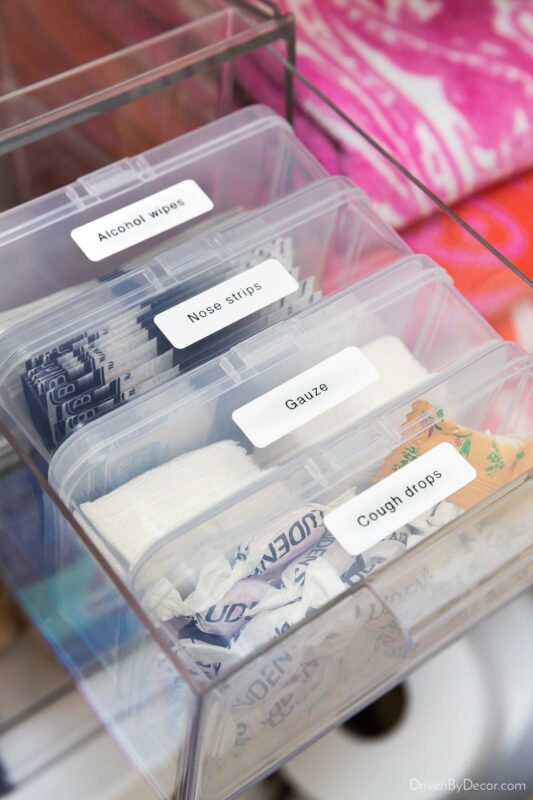
In order to click on alcohol wipes in this screenshot , I will do `click(47, 298)`.